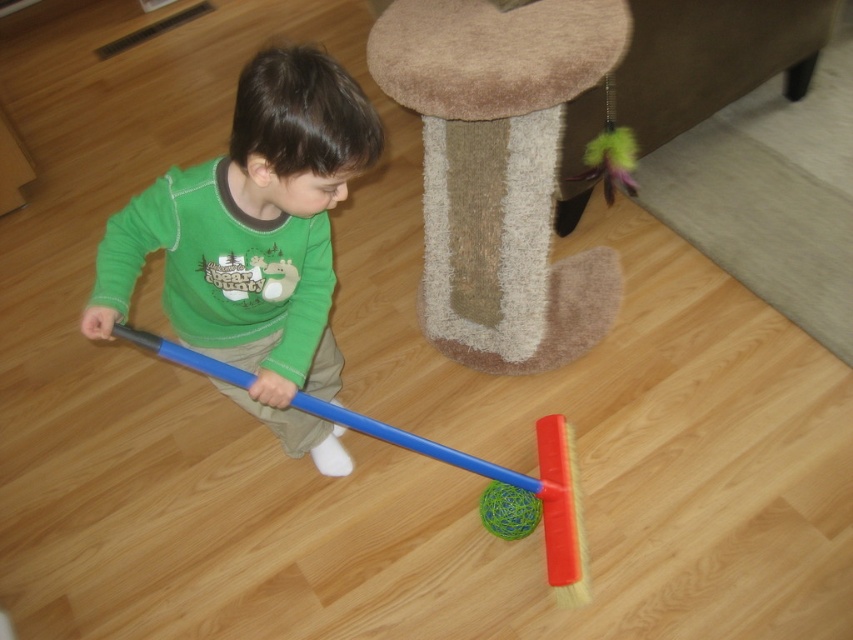
Question: Considering the real-world distances, which object is farthest from the green matte shirt at center?

Choices:
 (A) beige plush stool at upper center
 (B) blue plastic broom at center

Answer: (A)

Question: Which point is closer to the camera?

Choices:
 (A) (612, 10)
 (B) (317, 461)
 (C) (573, 579)

Answer: (C)

Question: Does green matte shirt at center appear over blue plastic broom at center?

Choices:
 (A) yes
 (B) no

Answer: (A)

Question: Can you confirm if beige plush stool at upper center is positioned to the left of green matte shirt at center?

Choices:
 (A) yes
 (B) no

Answer: (B)

Question: Does green matte shirt at center lie behind blue plastic broom at center?

Choices:
 (A) no
 (B) yes

Answer: (A)

Question: Which point is closer to the camera?

Choices:
 (A) blue plastic broom at center
 (B) beige plush stool at upper center
 (C) green matte shirt at center

Answer: (C)